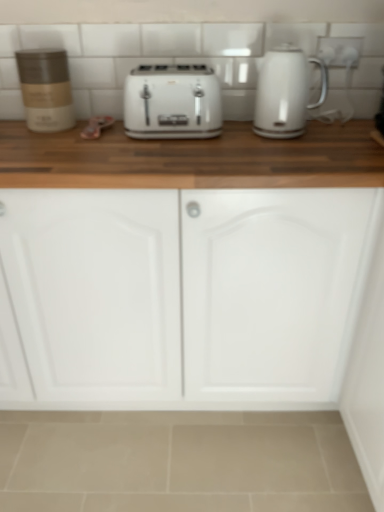
Where is `white matte cabinet doors at center`? This screenshot has height=512, width=384. white matte cabinet doors at center is located at coordinates (187, 291).

Describe the element at coordinates (285, 92) in the screenshot. I see `white glossy electric kettle at upper right` at that location.

What do you see at coordinates (172, 102) in the screenshot? I see `white glossy toaster at center` at bounding box center [172, 102].

Identify the location of white matte cabinet doors at center. This screenshot has width=384, height=512. (187, 291).

From the image's perspective, is white glossy electric kettle at upper right on top of white glossy toaster at center?

Yes.

In terms of size, does white glossy electric kettle at upper right appear bigger or smaller than white glossy toaster at center?

Clearly, white glossy electric kettle at upper right is smaller in size than white glossy toaster at center.

Can you see white glossy electric kettle at upper right touching white glossy toaster at center?

No, white glossy electric kettle at upper right is not next to white glossy toaster at center.

Based on the photo, is white glossy toaster at center far from matte brown container at left?

No, white glossy toaster at center is not far away from matte brown container at left.

Is white glossy toaster at center facing towards matte brown container at left?

No, white glossy toaster at center is not oriented towards matte brown container at left.

Looking at their sizes, would you say white glossy toaster at center is wider or thinner than matte brown container at left?

In the image, white glossy toaster at center appears to be wider than matte brown container at left.

Which is in front, white glossy toaster at center or matte brown container at left?

white glossy toaster at center is closer to the camera.

Considering the sizes of objects white glossy toaster at center and white glossy electric outlet at upper right in the image provided, who is wider, white glossy toaster at center or white glossy electric outlet at upper right?

white glossy toaster at center is wider.

Is white glossy toaster at center to the left of white glossy electric outlet at upper right from the viewer's perspective?

Yes.

From the image's perspective, would you say white glossy toaster at center is positioned over white glossy electric outlet at upper right?

No, from the image's perspective, white glossy toaster at center is not on top of white glossy electric outlet at upper right.

Is there a large distance between white glossy toaster at center and white glossy electric outlet at upper right?

No, white glossy toaster at center is not far from white glossy electric outlet at upper right.

From a real-world perspective, is white matte cabinet doors at center positioned over matte brown container at left based on gravity?

No.

Considering the relative sizes of white matte cabinet doors at center and matte brown container at left in the image provided, is white matte cabinet doors at center wider than matte brown container at left?

Indeed, white matte cabinet doors at center has a greater width compared to matte brown container at left.

From the image's perspective, relative to matte brown container at left, is white matte cabinet doors at center above or below?

Clearly, from the image's perspective, white matte cabinet doors at center is below matte brown container at left.

From a real-world perspective, is white glossy electric kettle at upper right beneath white matte cabinet doors at center?

Incorrect, from a real-world perspective, white glossy electric kettle at upper right is higher than white matte cabinet doors at center.

At what (x,y) coordinates should I click in order to perform the action: click on home appliance behind the white matte cabinet doors at center. Please return your answer as a coordinate pair (x, y). Looking at the image, I should click on (285, 92).

Based on the photo, visually, is white glossy electric kettle at upper right positioned to the left or to the right of white matte cabinet doors at center?

In the image, white glossy electric kettle at upper right appears on the right side of white matte cabinet doors at center.

From the image's perspective, is white glossy electric kettle at upper right located above or below white matte cabinet doors at center?

From the image's perspective, white glossy electric kettle at upper right appears above white matte cabinet doors at center.

Considering the positions of point (158, 360) and point (350, 56), is point (158, 360) closer or farther from the camera than point (350, 56)?

Clearly, point (158, 360) is closer to the camera than point (350, 56).

Which object is wider, white matte cabinet doors at center or white glossy electric outlet at upper right?

With larger width is white matte cabinet doors at center.

From a real-world perspective, is white matte cabinet doors at center positioned above or below white glossy electric outlet at upper right?

white matte cabinet doors at center is below white glossy electric outlet at upper right.

Measure the distance between matte brown container at left and white glossy electric outlet at upper right.

matte brown container at left and white glossy electric outlet at upper right are 89.86 centimeters apart.

Is matte brown container at left situated inside white glossy electric outlet at upper right or outside?

The correct answer is: outside.

Is matte brown container at left not near white glossy electric outlet at upper right?

Actually, matte brown container at left and white glossy electric outlet at upper right are a little close together.

Consider the image. From a real-world perspective, which is physically above, matte brown container at left or white glossy electric outlet at upper right?

white glossy electric outlet at upper right.

At what (x,y) coordinates should I click in order to perform the action: click on toaster behind the white glossy electric kettle at upper right. Please return your answer as a coordinate pair (x, y). Image resolution: width=384 pixels, height=512 pixels. Looking at the image, I should click on (172, 102).

Locate an element on the screen. Image resolution: width=384 pixels, height=512 pixels. kitchen appliance above the white glossy toaster at center (from a real-world perspective) is located at coordinates (46, 89).

From the image, which object appears to be farther from matte brown container at left, white matte cabinet doors at center or white glossy electric outlet at upper right?

white glossy electric outlet at upper right.

Looking at the image, which one is located further to white glossy electric kettle at upper right, white glossy toaster at center or white matte cabinet doors at center?

Result: white matte cabinet doors at center is positioned further to the anchor white glossy electric kettle at upper right.

Considering their positions, is matte brown container at left positioned further to white glossy toaster at center than white glossy electric outlet at upper right?

Among the two, white glossy electric outlet at upper right is located further to white glossy toaster at center.

Estimate the real-world distances between objects in this image. Which object is further from white matte cabinet doors at center, white glossy electric outlet at upper right or matte brown container at left?

The object further to white matte cabinet doors at center is white glossy electric outlet at upper right.

From the image, which object appears to be nearer to white matte cabinet doors at center, white glossy electric kettle at upper right or matte brown container at left?

white glossy electric kettle at upper right is closer to white matte cabinet doors at center.

Based on their spatial positions, is white glossy electric outlet at upper right or white glossy toaster at center closer to white matte cabinet doors at center?

The object closer to white matte cabinet doors at center is white glossy toaster at center.

From the image, which object appears to be nearer to matte brown container at left, white glossy electric kettle at upper right or white glossy toaster at center?

Based on the image, white glossy toaster at center appears to be nearer to matte brown container at left.

Based on their spatial positions, is white glossy electric kettle at upper right or white glossy electric outlet at upper right further from white glossy toaster at center?

Based on the image, white glossy electric outlet at upper right appears to be further to white glossy toaster at center.

Where is `cabinetry between matte brown container at left and white glossy electric outlet at upper right`? Image resolution: width=384 pixels, height=512 pixels. cabinetry between matte brown container at left and white glossy electric outlet at upper right is located at coordinates (187, 291).

Locate an element on the screen. This screenshot has height=512, width=384. home appliance between white glossy toaster at center and white glossy electric outlet at upper right from left to right is located at coordinates (285, 92).

Identify the location of home appliance located between matte brown container at left and white glossy electric outlet at upper right in the left-right direction. (285, 92).

Locate an element on the screen. The height and width of the screenshot is (512, 384). toaster between matte brown container at left and white glossy electric kettle at upper right in the horizontal direction is located at coordinates (172, 102).